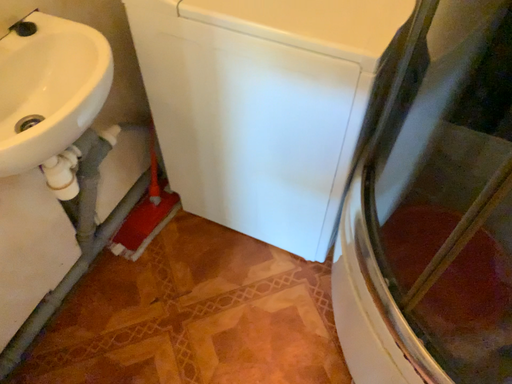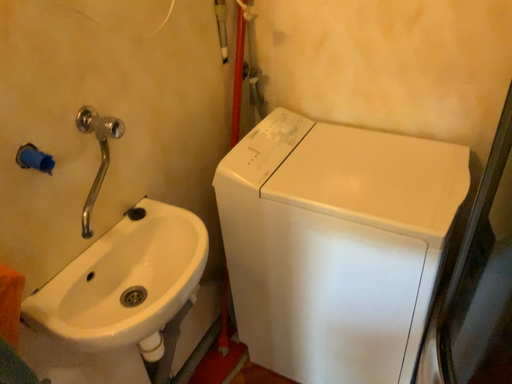
Question: How did the camera likely rotate when shooting the video?

Choices:
 (A) rotated right
 (B) rotated left

Answer: (B)